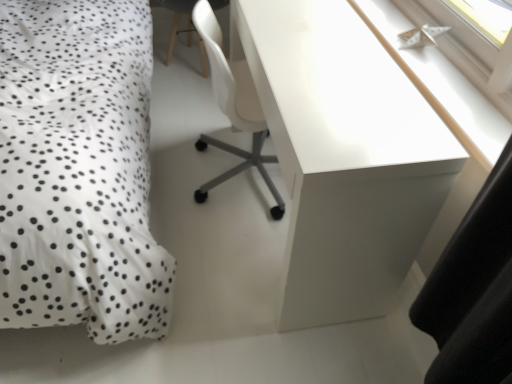
Question: From a real-world perspective, is white glossy paper boat at upper right beneath white dotted fabric at left?

Choices:
 (A) no
 (B) yes

Answer: (A)

Question: Is white glossy paper boat at upper right at the left side of white dotted fabric at left?

Choices:
 (A) no
 (B) yes

Answer: (A)

Question: Is white glossy paper boat at upper right facing away from white dotted fabric at left?

Choices:
 (A) yes
 (B) no

Answer: (B)

Question: Does white glossy paper boat at upper right lie in front of white dotted fabric at left?

Choices:
 (A) no
 (B) yes

Answer: (A)

Question: Does white glossy paper boat at upper right lie behind white dotted fabric at left?

Choices:
 (A) no
 (B) yes

Answer: (B)

Question: Can you confirm if white glossy paper boat at upper right is wider than white dotted fabric at left?

Choices:
 (A) yes
 (B) no

Answer: (B)

Question: Is white glossy desk at upper right to the left of white glossy paper boat at upper right from the viewer's perspective?

Choices:
 (A) no
 (B) yes

Answer: (B)

Question: Is white glossy desk at upper right completely or partially outside of white glossy paper boat at upper right?

Choices:
 (A) yes
 (B) no

Answer: (A)

Question: Is there a large distance between white glossy desk at upper right and white glossy paper boat at upper right?

Choices:
 (A) yes
 (B) no

Answer: (B)

Question: Is white glossy desk at upper right facing away from white glossy paper boat at upper right?

Choices:
 (A) yes
 (B) no

Answer: (A)

Question: From a real-world perspective, is white glossy desk at upper right located higher than white glossy paper boat at upper right?

Choices:
 (A) no
 (B) yes

Answer: (A)

Question: Does white glossy desk at upper right have a larger size compared to white glossy paper boat at upper right?

Choices:
 (A) no
 (B) yes

Answer: (B)

Question: From a real-world perspective, is white dotted fabric at left located beneath white glossy desk at upper right?

Choices:
 (A) no
 (B) yes

Answer: (A)